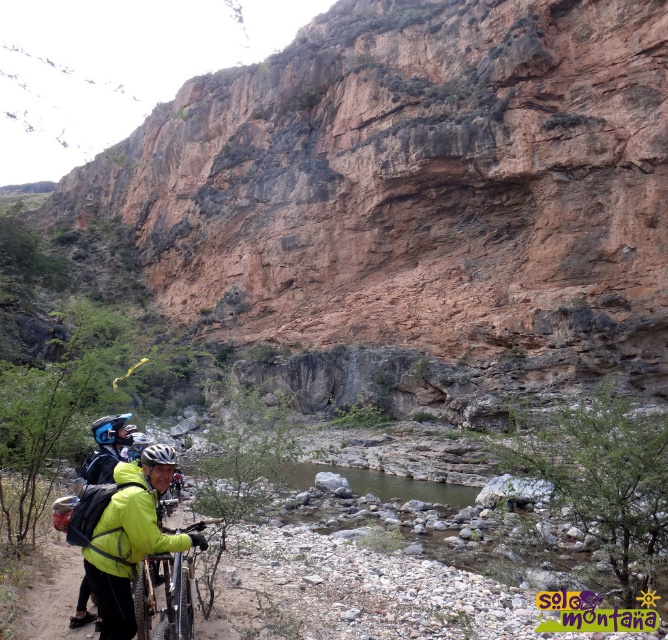
Is neon yellow jacket at center smaller than shiny metallic bicycle at center?

Correct, neon yellow jacket at center occupies less space than shiny metallic bicycle at center.

Which is more to the left, neon yellow jacket at center or shiny metallic bicycle at center?

neon yellow jacket at center is more to the left.

Is point (150, 547) positioned behind point (150, 564)?

That is False.

Locate an element on the screen. neon yellow jacket at center is located at coordinates (130, 538).